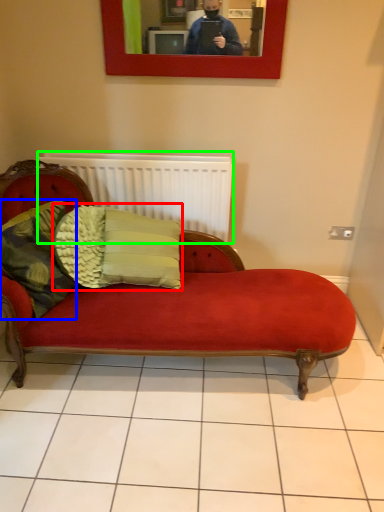
Question: Which object is positioned farthest from pillow (highlighted by a red box)? Select from pillow (highlighted by a blue box) and radiator (highlighted by a green box).

Choices:
 (A) pillow
 (B) radiator

Answer: (B)